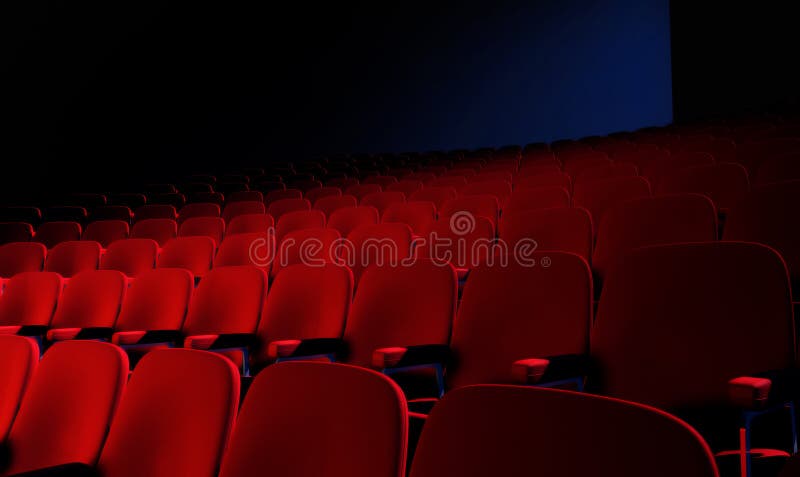
I want to click on chair arms, so click(x=24, y=329), click(x=61, y=333), click(x=134, y=338), click(x=214, y=341), click(x=306, y=345), click(x=406, y=355), click(x=541, y=367), click(x=749, y=388), click(x=70, y=469).